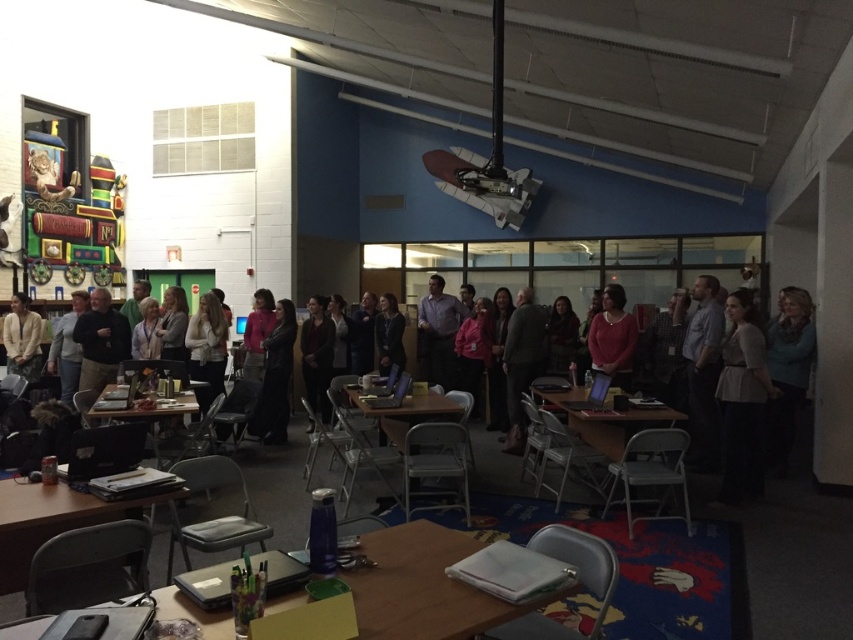
Between wooden table at lower center and wooden folding table at center, which one has more height?

Standing taller between the two is wooden folding table at center.

Who is more distant from viewer, (364,608) or (408,406)?

Positioned behind is point (408,406).

Which is behind, point (403, 579) or point (398, 445)?

The point (398, 445) is behind.

Locate an element on the screen. Image resolution: width=853 pixels, height=640 pixels. wooden table at lower center is located at coordinates (422, 586).

Between dark brown sweater at center and wooden folding table at center, which one is positioned higher?

dark brown sweater at center is above.

Is dark brown sweater at center to the left of wooden folding table at center from the viewer's perspective?

Yes, dark brown sweater at center is to the left of wooden folding table at center.

Describe the element at coordinates (317, 355) in the screenshot. Image resolution: width=853 pixels, height=640 pixels. I see `dark brown sweater at center` at that location.

Find the location of a particular element. This screenshot has width=853, height=640. dark brown sweater at center is located at coordinates (317, 355).

Between gray fabric shirt at center and dark gray sweater at center, which one is positioned lower?

gray fabric shirt at center

Who is shorter, gray fabric shirt at center or dark gray sweater at center?

With less height is dark gray sweater at center.

Does point (750, 291) come in front of point (393, 340)?

Yes, point (750, 291) is in front of point (393, 340).

Where is `gray fabric shirt at center`? The image size is (853, 640). gray fabric shirt at center is located at coordinates point(741,401).